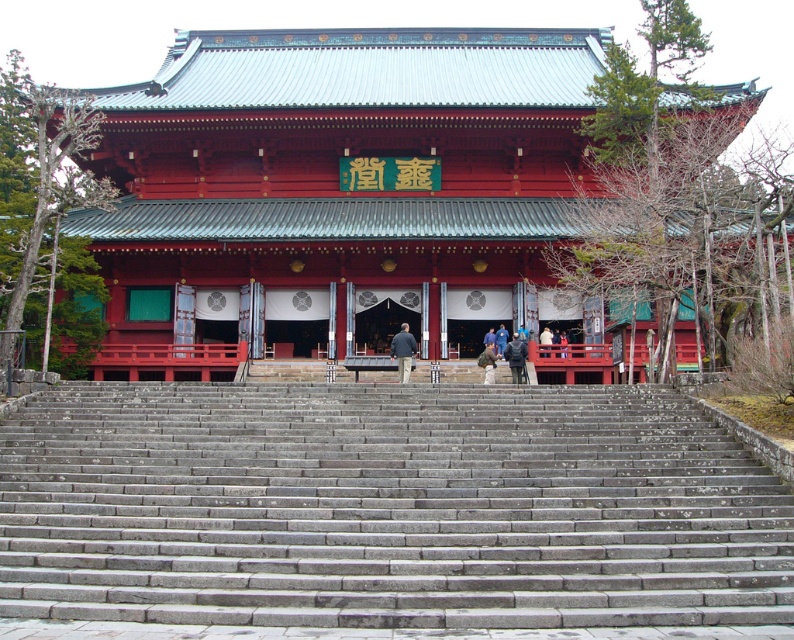
From the picture: You are standing at the base of the stone steps leading to the temple. You see two jackets placed at the center of the steps. One is labeled as dark gray jacket at center and the other as dark gray fabric jacket at center. Which jacket is closer to you?

The dark gray jacket at center is 6.68 meters away from the dark gray fabric jacket at center. Since both jackets are at the center of the steps, their distance from you depends on their placement relative to each other. However, the description only provides the distance between them, not their positions from the viewer. Without additional information about their exact locations along the steps, it is impossible to determine which jacket is closer to you.

Consider the image. You are visiting the temple and want to take a photo of the dark gray stone person at center and the light brown leather jacket at center. Which object should you focus on first if you want to capture both in a single frame without moving the camera?

You should focus on the dark gray stone person at center first because it is taller than the light brown leather jacket at center, ensuring both fit within the frame.

You are standing at the bottom of the stone steps leading to the shiny red wood temple at center and the dark gray jacket at center. Which object is located to the left when facing the temple?

Answer: The shiny red wood temple at center is positioned on the left side of dark gray jacket at center, so when facing the temple, the shiny red wood temple at center is to the left.